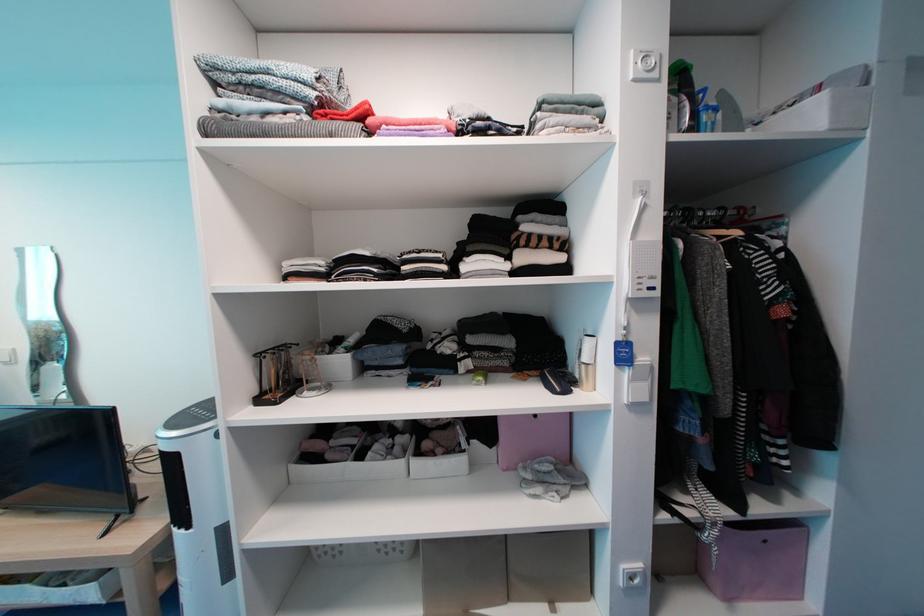
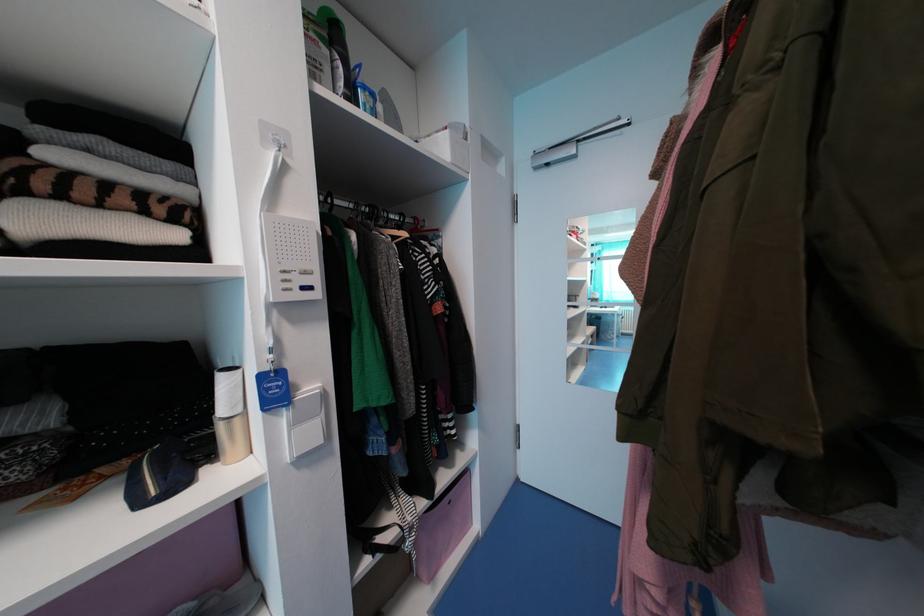
Question: The first image is from the beginning of the video and the second image is from the end. How did the camera likely rotate when shooting the video?

Choices:
 (A) Left
 (B) Right
 (C) Up
 (D) Down

Answer: (B)